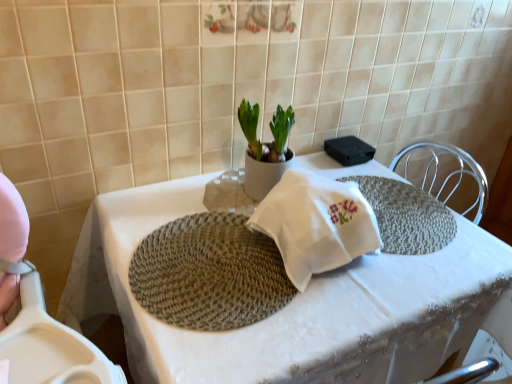
Locate an element on the screen. This screenshot has width=512, height=384. vacant position to the left of white ceramic pot at center is located at coordinates (203, 195).